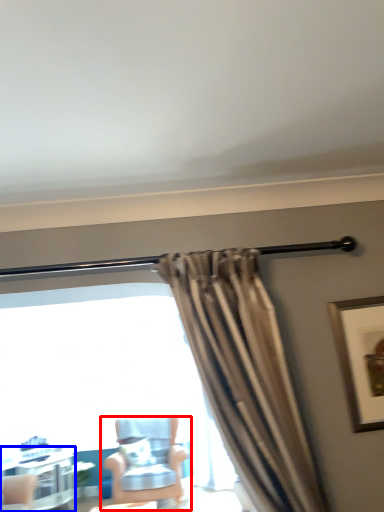
Question: Which object appears farthest to the camera in this image, chair (highlighted by a red box) or table (highlighted by a blue box)?

Choices:
 (A) chair
 (B) table

Answer: (B)